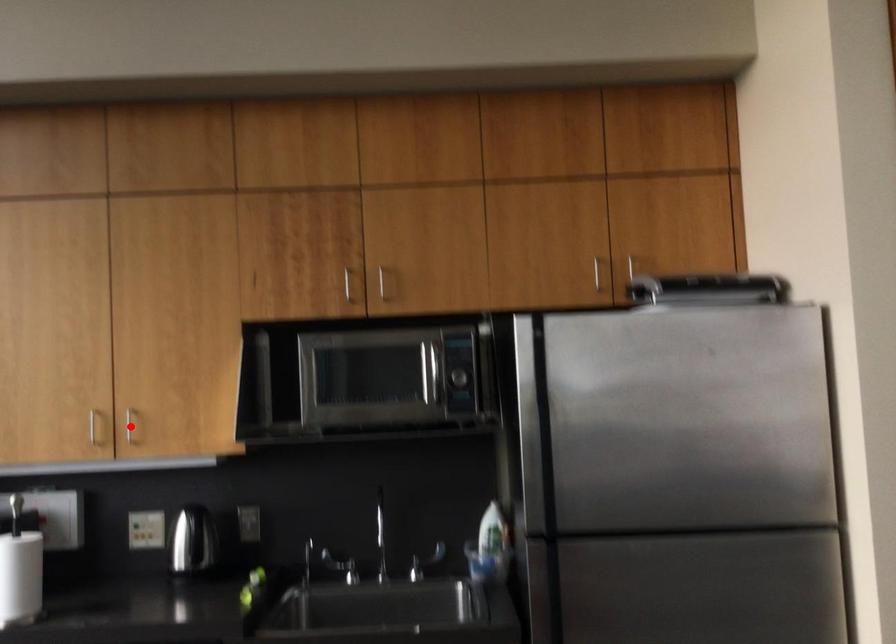
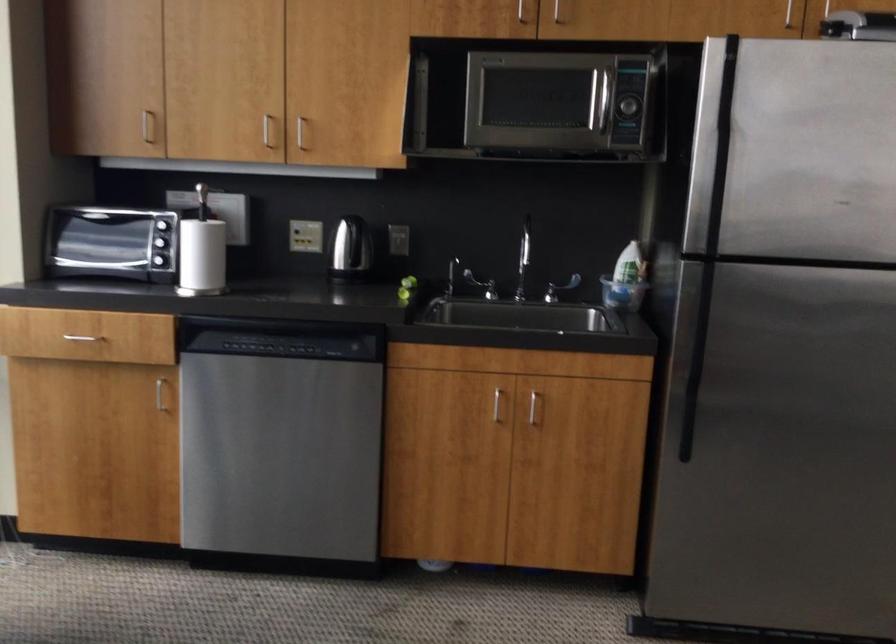
In the second image, find the point that corresponds to the highlighted location in the first image.

(300, 131)